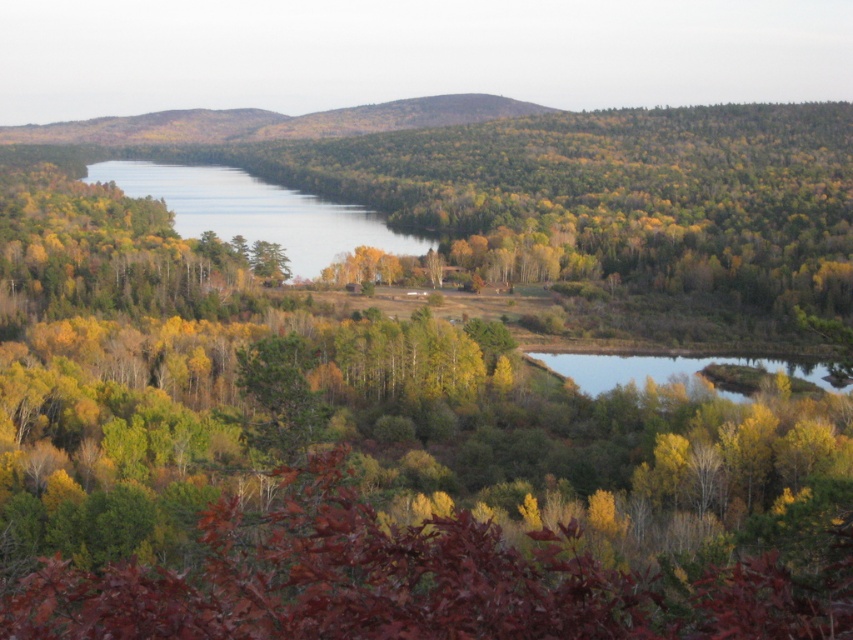
You are a hiker standing at the edge of the forest. You see two areas of clear water in the scene. Which one is closer to you, the clear water at center or the clear water at bottom right?

The clear water at center is closer to you because it is further to the viewer than the clear water at bottom right.

You are an outdoor photographer planning to capture the reflection of the autumn trees in the water. You have two options for positioning your camera near the clear water at center and the clear water at bottom right. Which location would allow you to frame the autumn trees more to the right side of your photo?

The clear water at center is to the left of clear water at bottom right, so positioning the camera at the clear water at bottom right would allow you to frame the autumn trees more to the right side of the photo.

You are an environmental scientist assessing water quality in this landscape. You observe two areas of clear water at center and clear water at bottom right. Which area is located higher in elevation?

The clear water at center is positioned over clear water at bottom right, meaning it is higher in elevation.